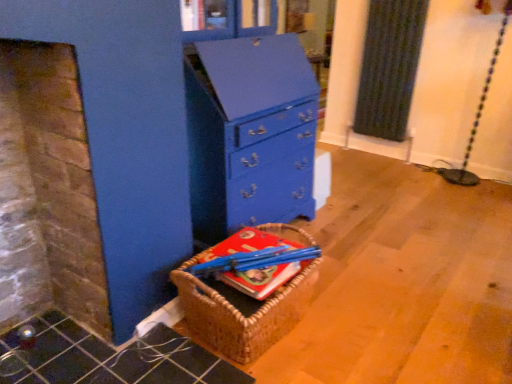
Question: Considering the relative sizes of hardcover book at center and woven brown basket at lower left in the image provided, is hardcover book at center thinner than woven brown basket at lower left?

Choices:
 (A) no
 (B) yes

Answer: (B)

Question: Could you tell me if hardcover book at center is facing woven brown basket at lower left?

Choices:
 (A) yes
 (B) no

Answer: (A)

Question: Are hardcover book at center and woven brown basket at lower left making contact?

Choices:
 (A) no
 (B) yes

Answer: (B)

Question: Considering the relative sizes of hardcover book at center and woven brown basket at lower left in the image provided, is hardcover book at center bigger than woven brown basket at lower left?

Choices:
 (A) no
 (B) yes

Answer: (A)

Question: From a real-world perspective, is hardcover book at center physically above woven brown basket at lower left?

Choices:
 (A) no
 (B) yes

Answer: (B)

Question: Looking at their shapes, would you say hardcover book at center is wider or thinner than blue painted wood chest of drawers at center?

Choices:
 (A) thin
 (B) wide

Answer: (A)

Question: Is hardcover book at center bigger or smaller than blue painted wood chest of drawers at center?

Choices:
 (A) small
 (B) big

Answer: (A)

Question: From a real-world perspective, is hardcover book at center above or below blue painted wood chest of drawers at center?

Choices:
 (A) above
 (B) below

Answer: (B)

Question: Considering the relative positions of hardcover book at center and blue painted wood chest of drawers at center in the image provided, is hardcover book at center to the left or to the right of blue painted wood chest of drawers at center?

Choices:
 (A) right
 (B) left

Answer: (A)

Question: Is point (289, 99) closer or farther from the camera than point (307, 302)?

Choices:
 (A) farther
 (B) closer

Answer: (A)

Question: Considering the positions of blue painted wood chest of drawers at center and woven brown basket at lower left in the image, is blue painted wood chest of drawers at center taller or shorter than woven brown basket at lower left?

Choices:
 (A) tall
 (B) short

Answer: (A)

Question: Considering the positions of blue painted wood chest of drawers at center and woven brown basket at lower left in the image, is blue painted wood chest of drawers at center wider or thinner than woven brown basket at lower left?

Choices:
 (A) wide
 (B) thin

Answer: (A)

Question: From the image's perspective, is blue painted wood chest of drawers at center located above or below woven brown basket at lower left?

Choices:
 (A) below
 (B) above

Answer: (B)

Question: From their relative heights in the image, would you say blue painted wood chest of drawers at center is taller or shorter than hardcover book at center?

Choices:
 (A) short
 (B) tall

Answer: (B)

Question: In terms of size, does blue painted wood chest of drawers at center appear bigger or smaller than hardcover book at center?

Choices:
 (A) small
 (B) big

Answer: (B)